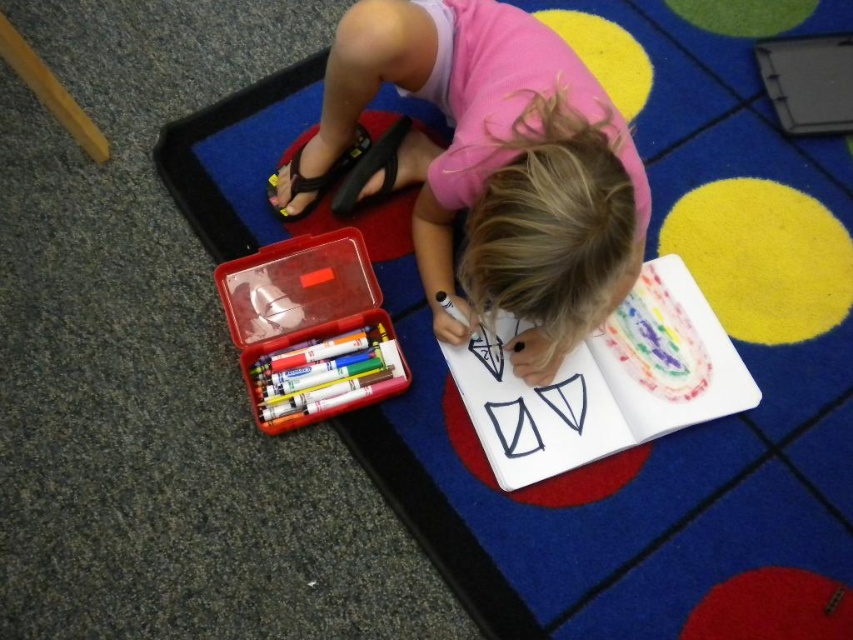
Based on the scene description, where is the pink fabric child at center located in terms of coordinates?

The pink fabric child at center is located at coordinates point (494, 164).

You are standing in front of the child drawing on the colorful rug. There are two points marked on the paper at coordinates point (561, 324) and point (398, 344). Which point is closer to you?

Point (561, 324) is closer to the viewer than point (398, 344).